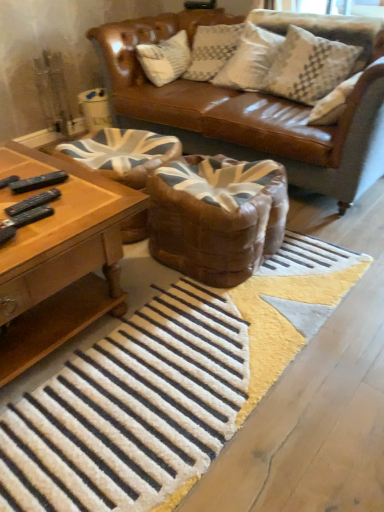
Identify the location of vacant space in white textured rug at center (from a real-world perspective). (154, 376).